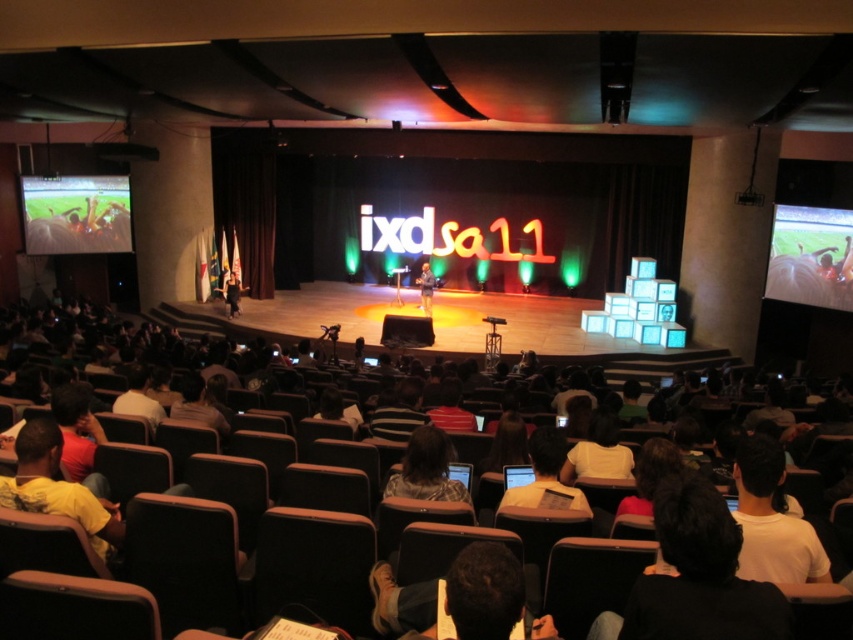
Is point (418, 426) farther from viewer compared to point (541, 448)?

Yes, it is behind point (541, 448).

Can you confirm if plaid shirt at center is positioned to the left of white plastic laptop at center?

Indeed, plaid shirt at center is positioned on the left side of white plastic laptop at center.

The height and width of the screenshot is (640, 853). What do you see at coordinates (426, 468) in the screenshot?
I see `plaid shirt at center` at bounding box center [426, 468].

Locate an element on the screen. plaid shirt at center is located at coordinates (426, 468).

Describe the element at coordinates (544, 472) in the screenshot. Image resolution: width=853 pixels, height=640 pixels. I see `white plastic laptop at center` at that location.

Does white plastic laptop at center come in front of dark blue shirt at center stage?

Yes, it is in front of dark blue shirt at center stage.

Which is behind, point (547, 445) or point (427, 298)?

Point (427, 298)

Locate an element on the screen. white plastic laptop at center is located at coordinates (544, 472).

Is yellow t-shirt at lower left closer to the viewer compared to dark blue shirt at center stage?

Yes, yellow t-shirt at lower left is in front of dark blue shirt at center stage.

Can you confirm if yellow t-shirt at lower left is smaller than dark blue shirt at center stage?

Indeed, yellow t-shirt at lower left has a smaller size compared to dark blue shirt at center stage.

Locate an element on the screen. yellow t-shirt at lower left is located at coordinates (56, 486).